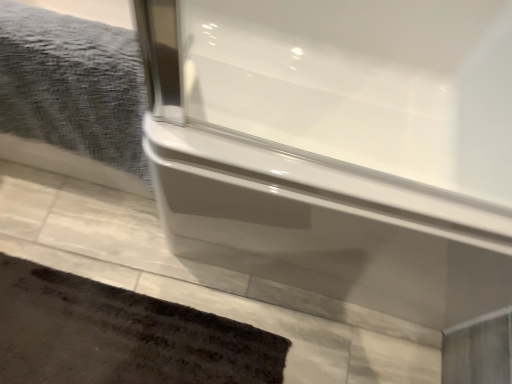
Question: Is gray textured towel at upper left bigger or smaller than dark brown textured bath mat at lower left?

Choices:
 (A) big
 (B) small

Answer: (A)

Question: From a real-world perspective, is gray textured towel at upper left above or below dark brown textured bath mat at lower left?

Choices:
 (A) above
 (B) below

Answer: (A)

Question: Is gray textured towel at upper left wider or thinner than dark brown textured bath mat at lower left?

Choices:
 (A) wide
 (B) thin

Answer: (B)

Question: From the image's perspective, is dark brown textured bath mat at lower left located above or below gray textured towel at upper left?

Choices:
 (A) above
 (B) below

Answer: (B)

Question: In the image, is dark brown textured bath mat at lower left on the left side or the right side of gray textured towel at upper left?

Choices:
 (A) left
 (B) right

Answer: (B)

Question: Considering the positions of dark brown textured bath mat at lower left and gray textured towel at upper left in the image, is dark brown textured bath mat at lower left bigger or smaller than gray textured towel at upper left?

Choices:
 (A) big
 (B) small

Answer: (B)

Question: Looking at their shapes, would you say dark brown textured bath mat at lower left is wider or thinner than gray textured towel at upper left?

Choices:
 (A) wide
 (B) thin

Answer: (A)